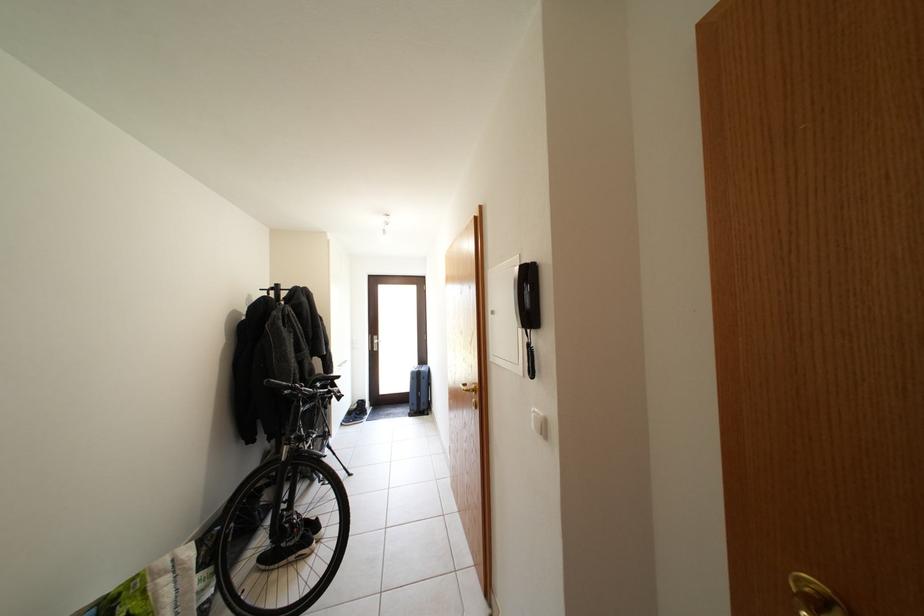
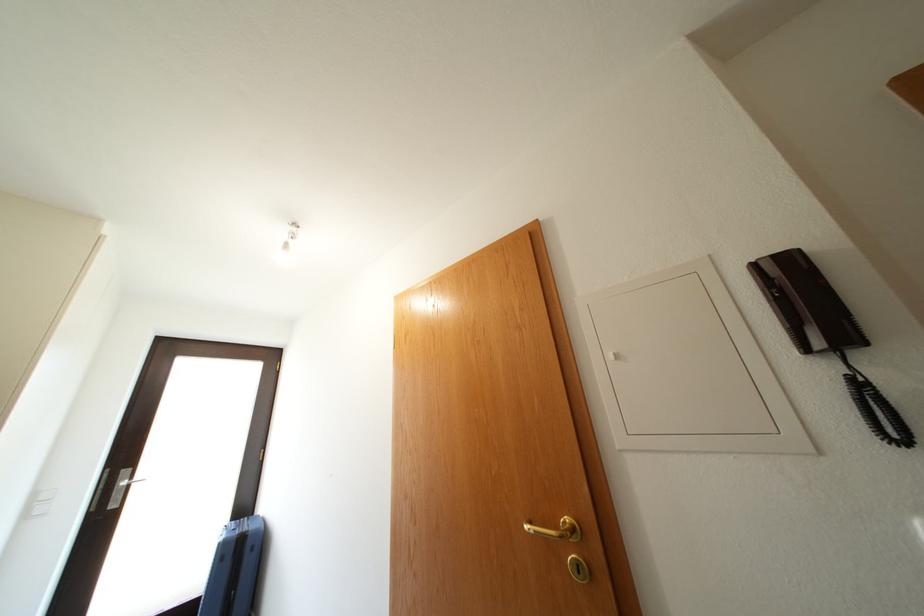
The point at [360,353] is marked in the first image. Where is the corresponding point in the second image?

(33, 522)